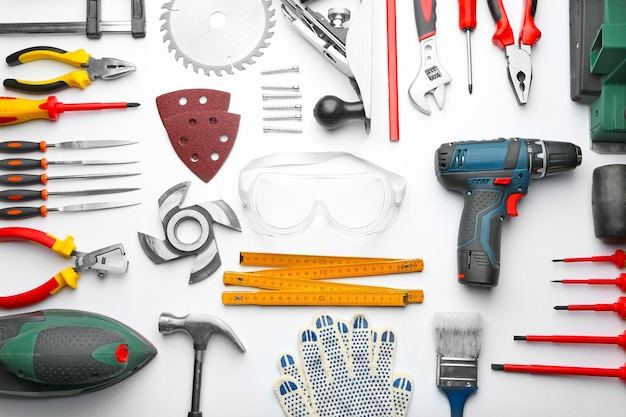
Identify the location of screws. The image size is (626, 417). (283, 66), (279, 85), (275, 98), (275, 106), (277, 119), (279, 129), (314, 140).